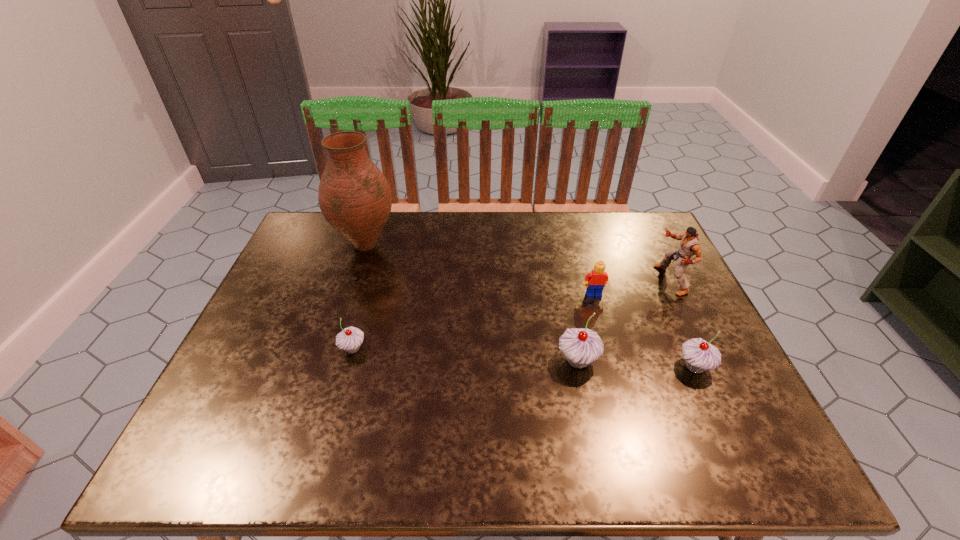
Where is `blank space that satisfies the following two spatial constraints: 1. on the front-facing side of the puncher; 2. on the face of the Lego`? The width and height of the screenshot is (960, 540). blank space that satisfies the following two spatial constraints: 1. on the front-facing side of the puncher; 2. on the face of the Lego is located at coordinates (678, 295).

Locate an element on the screen. The height and width of the screenshot is (540, 960). free region that satisfies the following two spatial constraints: 1. on the face of the Lego; 2. on the left side of the second shortest cupcake is located at coordinates (614, 367).

The image size is (960, 540). I want to click on free region that satisfies the following two spatial constraints: 1. on the face of the Lego; 2. on the right side of the rightmost cupcake, so click(x=614, y=367).

In order to click on vacant area that satisfies the following two spatial constraints: 1. on the front-facing side of the fifth shortest object; 2. on the face of the Lego in this screenshot , I will do `click(678, 295)`.

This screenshot has width=960, height=540. What are the coordinates of `blank area in the image that satisfies the following two spatial constraints: 1. on the front side of the leftmost cupcake; 2. on the left side of the tallest object` in the screenshot? It's located at [331, 349].